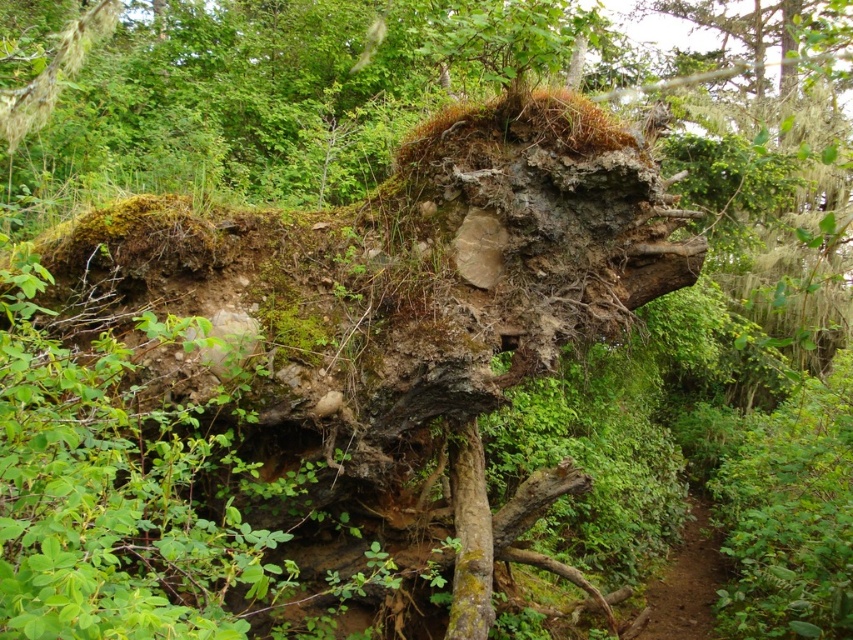
You are a hiker carrying a backpack and need to cross from the green mossy bark at center to the brown dirt path at lower right. Can you safely walk between them without any obstacles?

The distance between the green mossy bark at center and the brown dirt path at lower right is 3.10 meters, so yes, you can safely walk between them as there is enough space.

You are a botanist examining the natural scene. You notice the green mossy bark at center. Can you determine its exact position in the image using coordinates?

The green mossy bark at center is located at point coordinates of (469, 538).